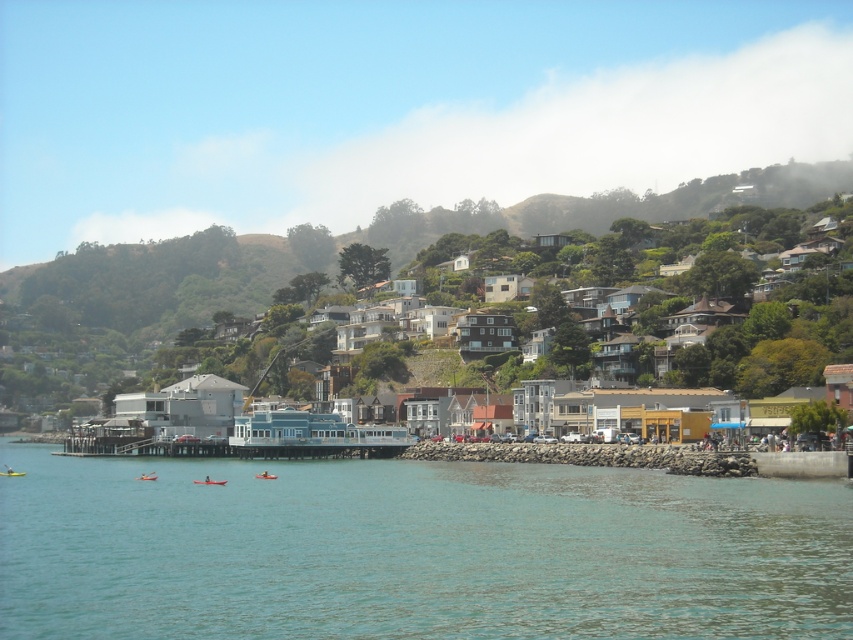
Is point (175, 291) positioned after point (151, 476)?

Yes, point (175, 291) is behind point (151, 476).

Between white matte houses at center and orange kayak at lower left, which one is positioned lower?

orange kayak at lower left

Is point (206, 259) positioned after point (151, 480)?

Yes, it is.

Find the location of a particular element. Image resolution: width=853 pixels, height=640 pixels. white matte houses at center is located at coordinates (138, 301).

Consider the image. Which is below, orange kayak at lower left or yellow plastic kayak at lower left?

yellow plastic kayak at lower left

What are the coordinates of `orange kayak at lower left` in the screenshot? It's located at (146, 476).

Identify the location of orange kayak at lower left. (146, 476).

How far apart are clear blue water at center and yellow plastic kayak at lower left?

They are 43.59 meters apart.

The height and width of the screenshot is (640, 853). In order to click on clear blue water at center in this screenshot , I will do `click(415, 550)`.

This screenshot has width=853, height=640. I want to click on clear blue water at center, so click(x=415, y=550).